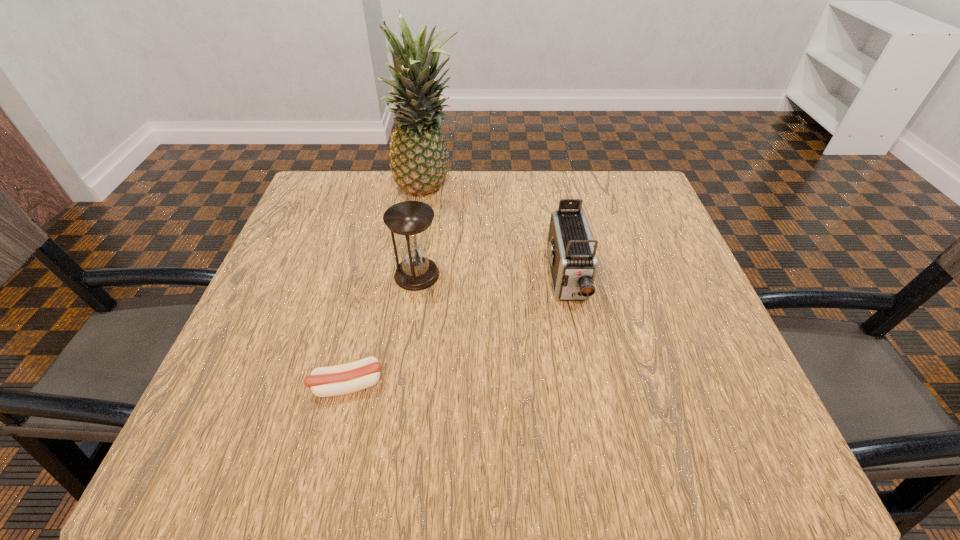
Find the location of a particular element. vacant area between the farthest object and the camcorder is located at coordinates (497, 235).

Image resolution: width=960 pixels, height=540 pixels. In order to click on free area in between the hourglass and the nearest object in this screenshot , I will do `click(382, 329)`.

Locate an element on the screen. free space between the pineapple and the camcorder is located at coordinates pos(497,235).

Where is `vacant space that's between the rightmost object and the shortest object`? This screenshot has width=960, height=540. vacant space that's between the rightmost object and the shortest object is located at coordinates (457, 332).

Where is `unoccupied area between the rightmost object and the sausage`? This screenshot has width=960, height=540. unoccupied area between the rightmost object and the sausage is located at coordinates (457, 332).

You are a GUI agent. You are given a task and a screenshot of the screen. Output one action in this format:
    pyautogui.click(x=<x>, y=<y>)
    Task: Click on the free space between the farthest object and the rightmost object
    
    Given the screenshot: What is the action you would take?
    pyautogui.click(x=497, y=235)

The width and height of the screenshot is (960, 540). Find the location of `free space between the hourglass and the shortest object`. free space between the hourglass and the shortest object is located at coordinates (382, 329).

Find the location of a particular element. free area in between the hourglass and the camcorder is located at coordinates (492, 277).

Locate an element on the screen. The width and height of the screenshot is (960, 540). object that is the nearest to the farthest object is located at coordinates (409, 220).

Locate an element on the screen. object that is the third closest one to the hourglass is located at coordinates click(573, 262).